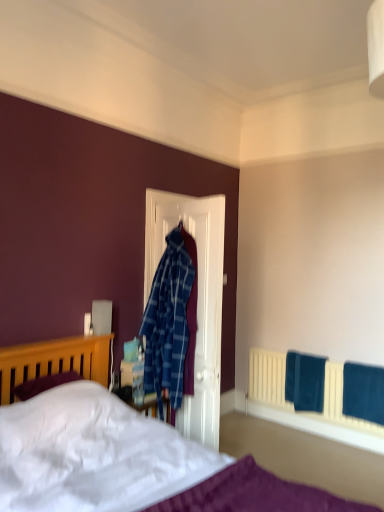
Question: Can you confirm if teal fabric towel at lower right, the second bath towel in the right-to-left sequence, is positioned to the left of velvet blue bath towel at lower right, which is the 1th bath towel in front-to-back order?

Choices:
 (A) no
 (B) yes

Answer: (B)

Question: From the image's perspective, is teal fabric towel at lower right, positioned as the 2th bath towel in front-to-back order, on top of velvet blue bath towel at lower right, the second bath towel positioned from the back?

Choices:
 (A) yes
 (B) no

Answer: (A)

Question: Would you consider teal fabric towel at lower right, marked as the first bath towel in a left-to-right arrangement, to be distant from velvet blue bath towel at lower right, the second bath towel positioned from the back?

Choices:
 (A) no
 (B) yes

Answer: (A)

Question: Does teal fabric towel at lower right, the second bath towel in the right-to-left sequence, come in front of velvet blue bath towel at lower right, the second bath towel positioned from the back?

Choices:
 (A) no
 (B) yes

Answer: (A)

Question: Is teal fabric towel at lower right, marked as the first bath towel in a left-to-right arrangement, bigger than velvet blue bath towel at lower right, positioned as the second bath towel in left-to-right order?

Choices:
 (A) no
 (B) yes

Answer: (B)

Question: Considering the relative positions of teal fabric towel at lower right, marked as the first bath towel in a left-to-right arrangement, and velvet blue bath towel at lower right, which is the 1th bath towel in front-to-back order, in the image provided, is teal fabric towel at lower right, marked as the first bath towel in a left-to-right arrangement, to the left or to the right of velvet blue bath towel at lower right, which is the 1th bath towel in front-to-back order,?

Choices:
 (A) left
 (B) right

Answer: (A)

Question: Looking at the image, does teal fabric towel at lower right, marked as the first bath towel in a left-to-right arrangement, seem bigger or smaller compared to velvet blue bath towel at lower right, positioned as the second bath towel in left-to-right order?

Choices:
 (A) big
 (B) small

Answer: (A)

Question: Relative to velvet blue bath towel at lower right, positioned as the second bath towel in left-to-right order, is teal fabric towel at lower right, marked as the first bath towel in a left-to-right arrangement, in front or behind?

Choices:
 (A) front
 (B) behind

Answer: (B)

Question: Considering the positions of teal fabric towel at lower right, positioned as the 2th bath towel in front-to-back order, and velvet blue bath towel at lower right, the second bath towel positioned from the back, in the image, is teal fabric towel at lower right, positioned as the 2th bath towel in front-to-back order, wider or thinner than velvet blue bath towel at lower right, the second bath towel positioned from the back,?

Choices:
 (A) wide
 (B) thin

Answer: (B)

Question: From the image's perspective, relative to velvet blue bath towel at lower right, which is the first bath towel from right to left, is white soft bed at lower left above or below?

Choices:
 (A) below
 (B) above

Answer: (B)

Question: Looking at the image, does white soft bed at lower left seem bigger or smaller compared to velvet blue bath towel at lower right, which is the 1th bath towel in front-to-back order?

Choices:
 (A) big
 (B) small

Answer: (A)

Question: From a real-world perspective, is white soft bed at lower left positioned above or below velvet blue bath towel at lower right, positioned as the second bath towel in left-to-right order?

Choices:
 (A) below
 (B) above

Answer: (B)

Question: From their relative heights in the image, would you say white soft bed at lower left is taller or shorter than velvet blue bath towel at lower right, the second bath towel positioned from the back?

Choices:
 (A) short
 (B) tall

Answer: (B)

Question: Looking at the image, does teal fabric towel at lower right, positioned as the 2th bath towel in front-to-back order, seem bigger or smaller compared to white soft bed at lower left?

Choices:
 (A) small
 (B) big

Answer: (A)

Question: Considering the positions of teal fabric towel at lower right, the second bath towel in the right-to-left sequence, and white soft bed at lower left in the image, is teal fabric towel at lower right, the second bath towel in the right-to-left sequence, taller or shorter than white soft bed at lower left?

Choices:
 (A) short
 (B) tall

Answer: (A)